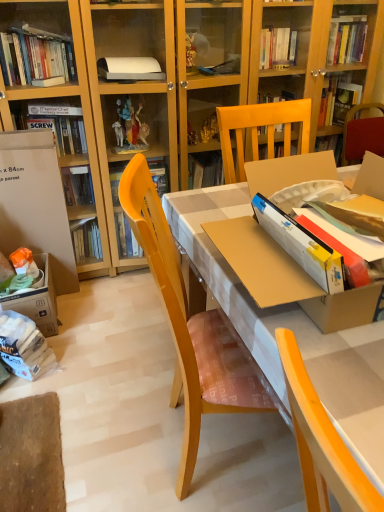
Identify the location of free space above white paper bag at lower left (from a real-world perspective). This screenshot has height=512, width=384. (8, 317).